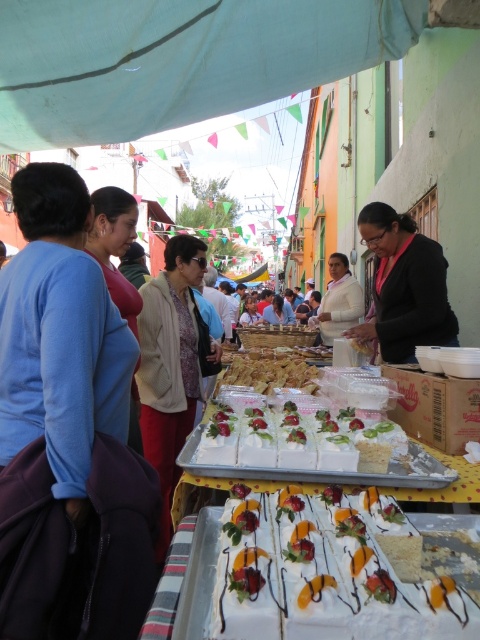
Question: Is blue fabric bag at left behind pink fabric at center?

Choices:
 (A) no
 (B) yes

Answer: (A)

Question: Among these points, which one is nearest to the camera?

Choices:
 (A) (180, 234)
 (B) (52, 547)
 (C) (345, 262)
 (D) (358, 540)

Answer: (D)

Question: Based on their relative distances, which object is nearer to the pink fabric at center?

Choices:
 (A) blue fabric bag at left
 (B) white frosted cake at center

Answer: (A)

Question: Among these points, which one is farthest from the camera?

Choices:
 (A) (58, 604)
 (B) (169, 404)
 (C) (328, 323)
 (D) (394, 264)

Answer: (C)

Question: Is white frosted cake at center to the left of beige fabric jacket at center from the viewer's perspective?

Choices:
 (A) no
 (B) yes

Answer: (A)

Question: Does white frosted cake at center appear under pink fabric at center?

Choices:
 (A) no
 (B) yes

Answer: (B)